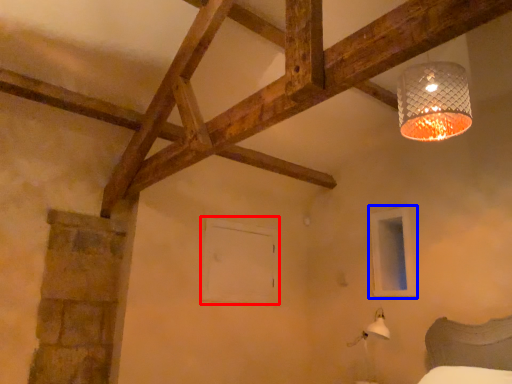
Question: Which object is closer to the camera taking this photo, window frame (highlighted by a red box) or window frame (highlighted by a blue box)?

Choices:
 (A) window frame
 (B) window frame

Answer: (B)